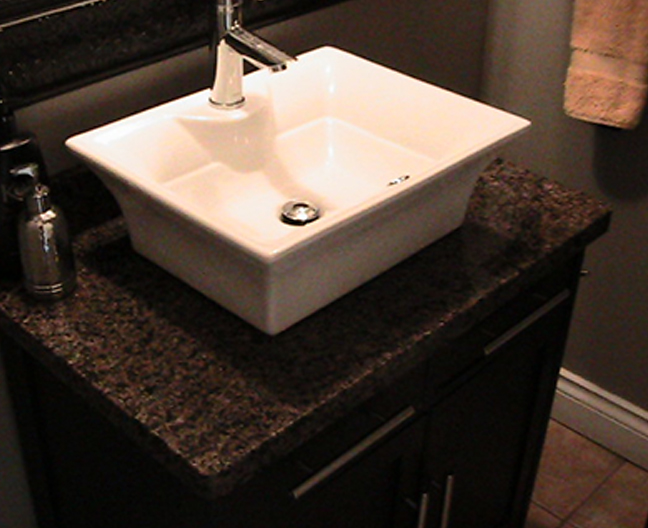
Locate an element on the screen. The image size is (648, 528). sink is located at coordinates (299, 157).